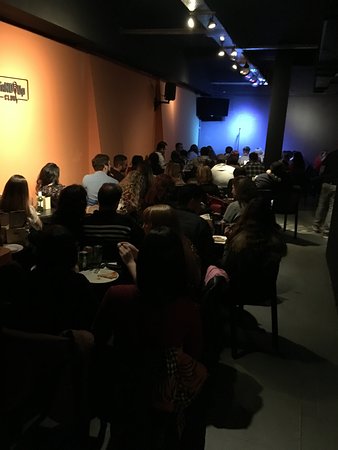
Find the location of a particular element. ceiling is located at coordinates (288, 18), (309, 68), (171, 58), (140, 16).